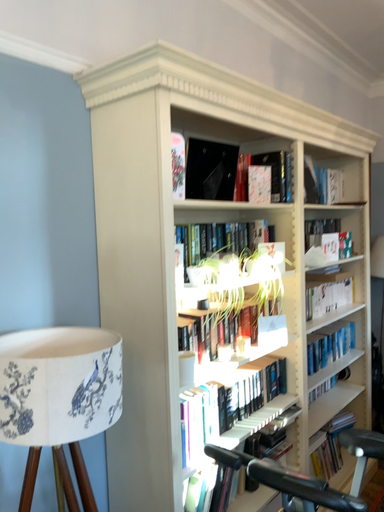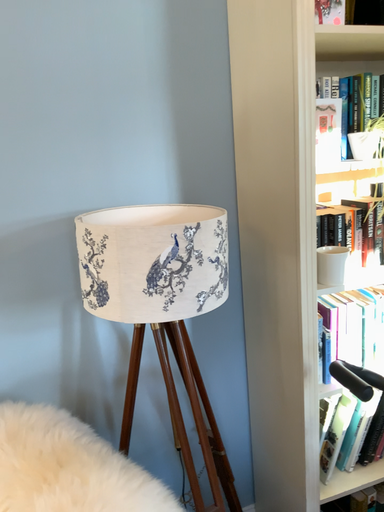
Question: How did the camera likely rotate when shooting the video?

Choices:
 (A) rotated left
 (B) rotated right

Answer: (A)